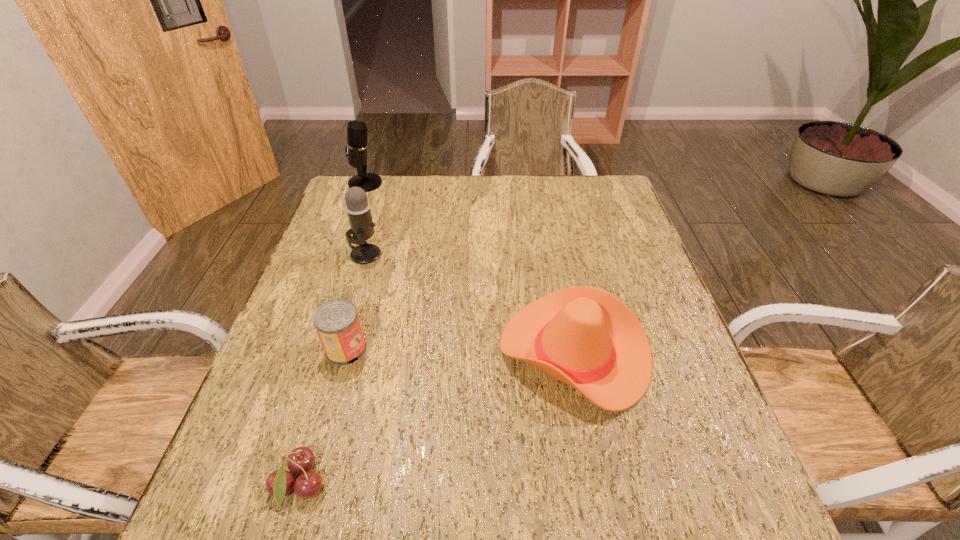
This screenshot has height=540, width=960. In order to click on vacant space at the left edge of the desktop in this screenshot , I will do `click(375, 230)`.

Where is `vacant space at the right edge of the desktop`? The width and height of the screenshot is (960, 540). vacant space at the right edge of the desktop is located at coordinates (669, 330).

Image resolution: width=960 pixels, height=540 pixels. What are the coordinates of `free spot at the far right corner of the desktop` in the screenshot? It's located at (615, 208).

Where is `unoccupied area between the shortest object and the can`? Image resolution: width=960 pixels, height=540 pixels. unoccupied area between the shortest object and the can is located at coordinates (323, 417).

Identify the location of free area in between the can and the nearest object. This screenshot has width=960, height=540. click(323, 417).

Identify the location of vacant point located between the second shortest object and the farthest object. This screenshot has width=960, height=540. (355, 266).

Identify the location of empty space that is in between the third shortest object and the farther microphone. (469, 268).

Locate an element on the screen. free space between the third tallest object and the second farthest object is located at coordinates (469, 303).

The height and width of the screenshot is (540, 960). I want to click on empty location between the can and the nearer microphone, so click(x=355, y=301).

Find the location of `vacant space in between the farther microphone and the rightmost object`. vacant space in between the farther microphone and the rightmost object is located at coordinates (469, 268).